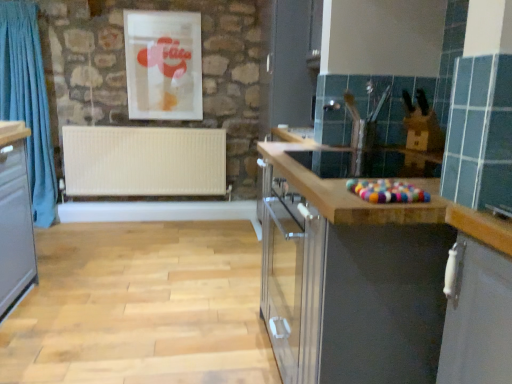
You are a GUI agent. You are given a task and a screenshot of the screen. Output one action in this format:
    pyautogui.click(x=<x>, y=<y>)
    Task: Click on the free space above matte plastic picture frame at upper center (from a real-world perspective)
    The image size is (512, 384).
    Given the screenshot: What is the action you would take?
    pyautogui.click(x=156, y=11)